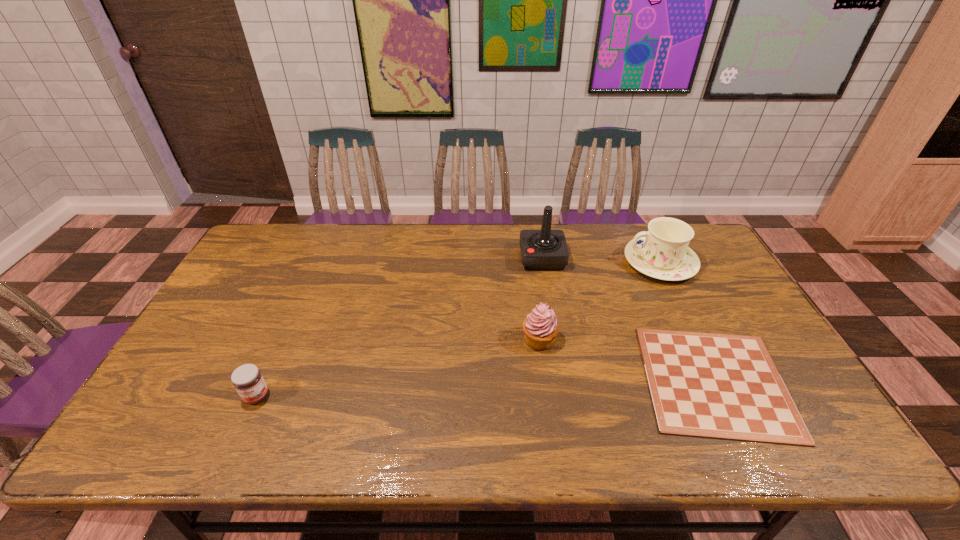
Locate an element on the screen. vacant region located 0.280m on the handle side of the chinaware is located at coordinates [x=540, y=262].

Locate an element on the screen. The width and height of the screenshot is (960, 540). vacant area located 0.380m on the handle side of the chinaware is located at coordinates (510, 262).

Where is `free location located 0.250m on the left of the cupcake`? The width and height of the screenshot is (960, 540). free location located 0.250m on the left of the cupcake is located at coordinates (430, 340).

Identify the location of free space located 0.100m on the front of the jam. (234, 447).

This screenshot has width=960, height=540. In order to click on blank space located on the back of the shortest object in this screenshot , I will do `click(677, 302)`.

The image size is (960, 540). I want to click on joystick that is at the far edge, so click(545, 249).

Where is `chinaware positioned at the far edge`? This screenshot has height=540, width=960. chinaware positioned at the far edge is located at coordinates (662, 252).

Locate an element on the screen. The height and width of the screenshot is (540, 960). object that is at the near edge is located at coordinates (719, 386).

Locate an element on the screen. chinaware present at the right edge is located at coordinates (662, 252).

At what (x,y) coordinates should I click in order to perform the action: click on checkerboard that is positioned at the right edge. Please return your answer as a coordinate pair (x, y). Image resolution: width=960 pixels, height=540 pixels. Looking at the image, I should click on (719, 386).